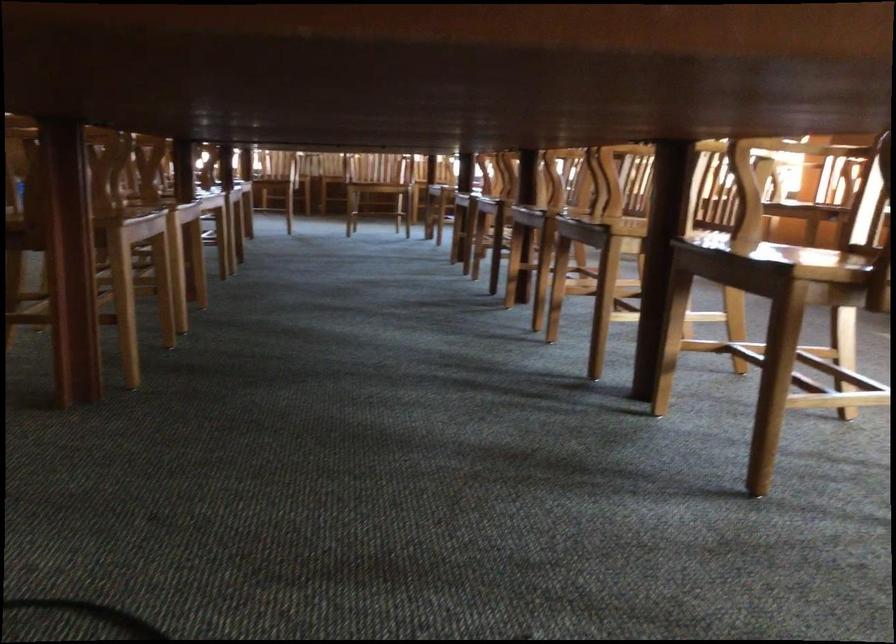
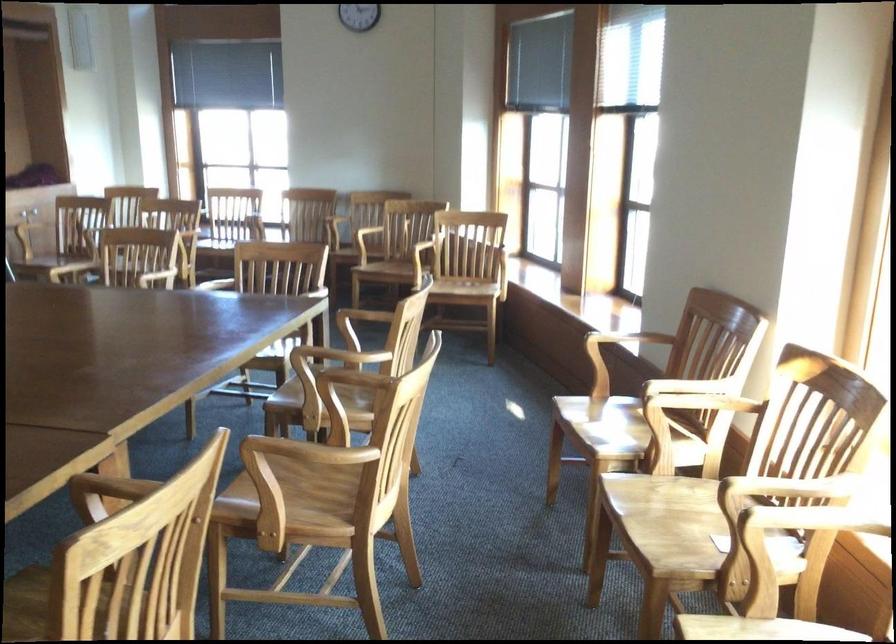
In a continuous first-person perspective shot, in which direction is the camera moving?

The movement direction of the cameraman is right, forward.